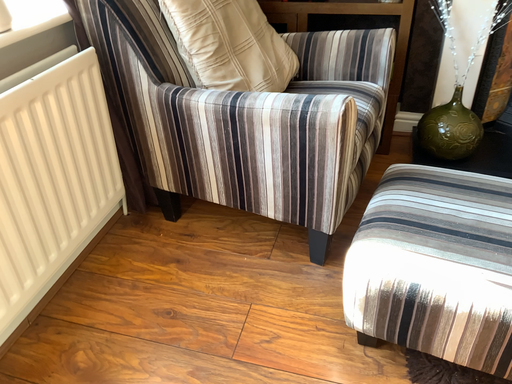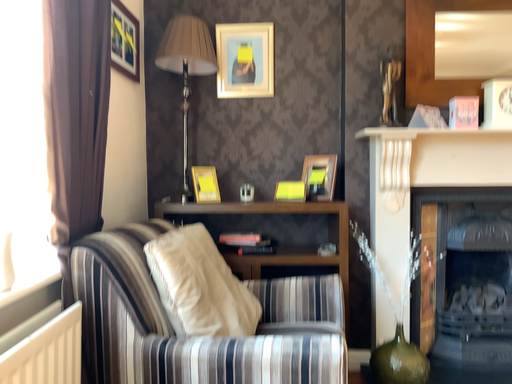
Question: Which way did the camera rotate in the video?

Choices:
 (A) rotated right
 (B) rotated left

Answer: (A)